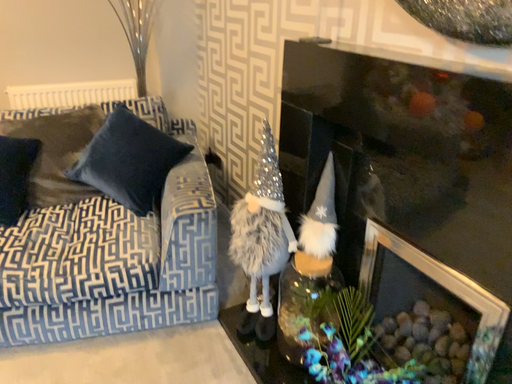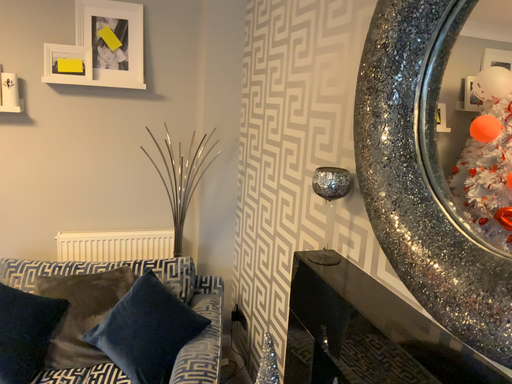
Question: Which way did the camera rotate in the video?

Choices:
 (A) rotated upward
 (B) rotated downward

Answer: (A)